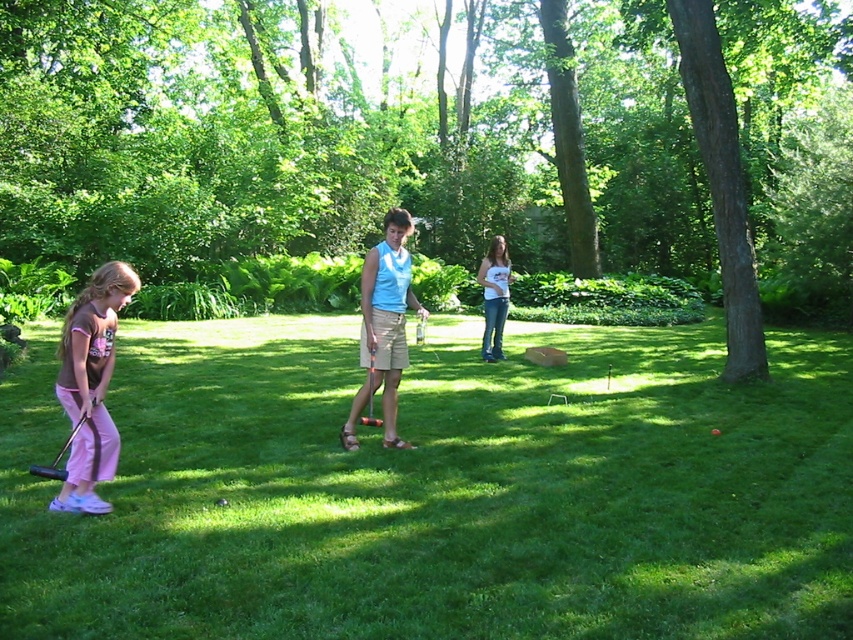
Does green grass at center appear on the right side of white cotton shirt at center?

In fact, green grass at center is to the left of white cotton shirt at center.

Between point (253, 416) and point (498, 291), which one is positioned in front?

Point (253, 416)

Who is more forward, (152, 458) or (491, 342)?

Point (152, 458) is more forward.

Identify the location of green grass at center. (439, 490).

Which of these two, green grass at center or matte pink pants at left, stands shorter?

green grass at center

Who is more forward, (412, 620) or (70, 369)?

Point (412, 620) is in front.

The image size is (853, 640). I want to click on green grass at center, so click(x=439, y=490).

Is matte pink pants at left taller than light blue fabric shirt at center?

No.

Is point (99, 301) closer to viewer compared to point (402, 365)?

Yes, it is in front of point (402, 365).

I want to click on matte pink pants at left, so click(91, 385).